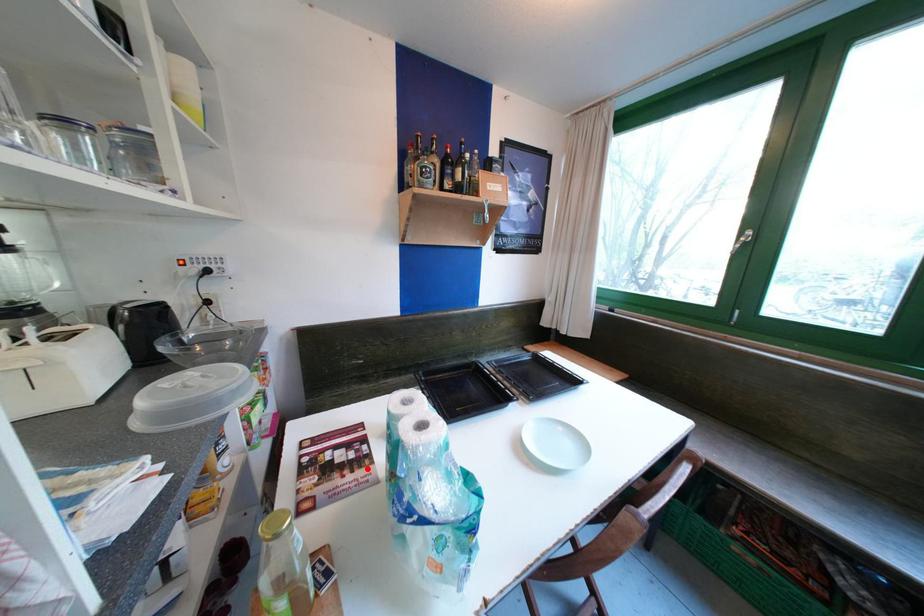
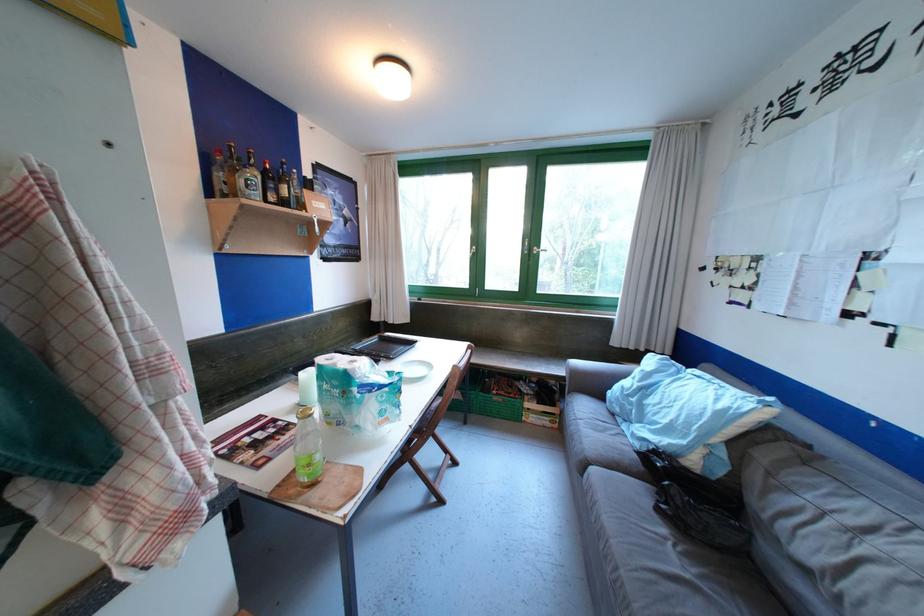
Question: I am providing you with two images of the same scene from different viewpoints. A red point is shown in image1. For the corresponding object point in image2, is it positioned nearer or farther from the camera?

Choices:
 (A) Nearer
 (B) Farther

Answer: (A)